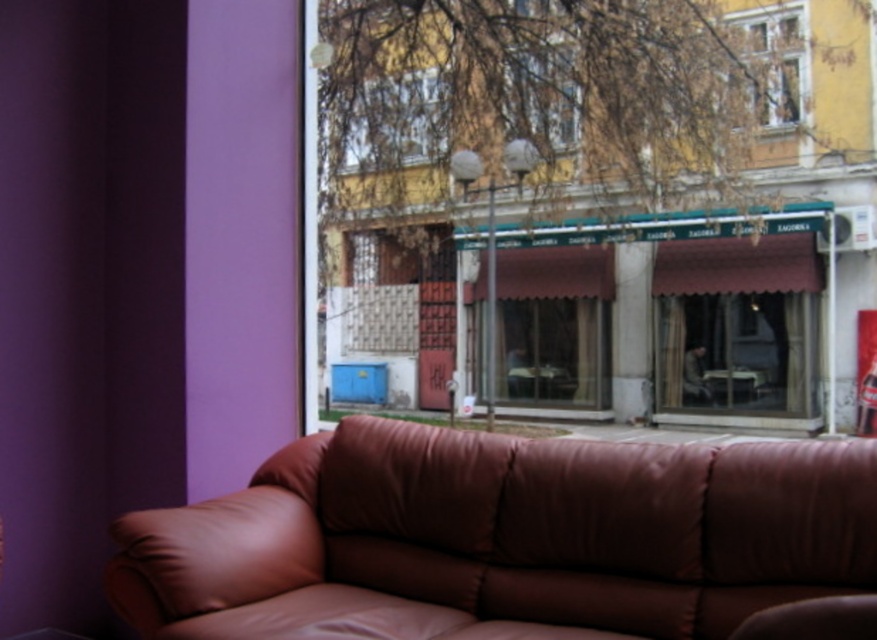
You are standing in the room with the brown leather sofa against the purple wall. You want to place a small plant exactly at the point with coordinates (x=501, y=538). Will the plant be placed on the sofa or somewhere else?

The point (x=501, y=538) corresponds to the leather couch at lower center, so placing the plant there would put it on the sofa.